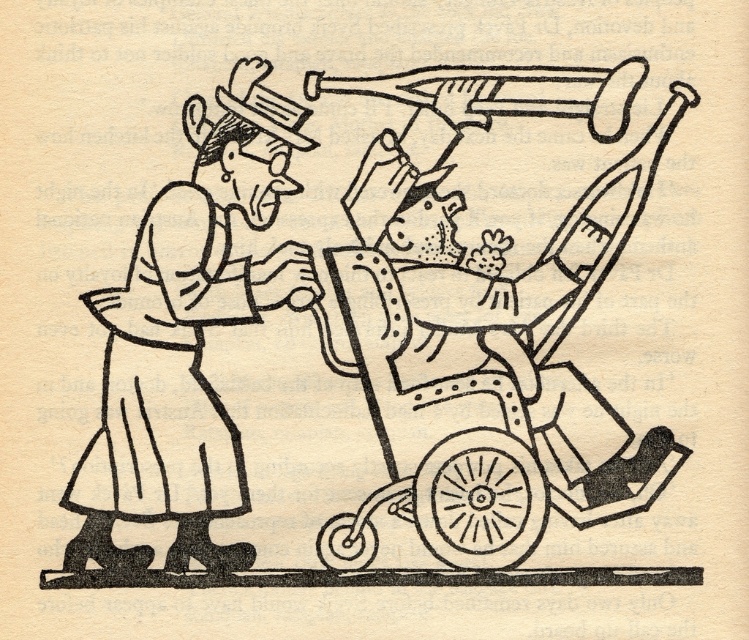
Is metallic baby carriage at center in front of smooth white dress at left?

That is True.

Measure the distance between metallic baby carriage at center and smooth white dress at left.

A distance of 6.02 inches exists between metallic baby carriage at center and smooth white dress at left.

Is point (562, 228) positioned after point (225, 188)?

Yes, it is behind point (225, 188).

At what (x,y) coordinates should I click in order to perform the action: click on metallic baby carriage at center. Please return your answer as a coordinate pair (x, y). The image size is (749, 640). Looking at the image, I should click on (485, 365).